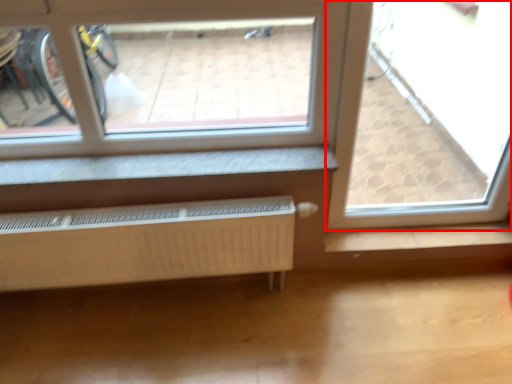
Question: From the image's perspective, what is the correct spatial positioning of window (annotated by the red box) in reference to radiator?

Choices:
 (A) above
 (B) below

Answer: (A)